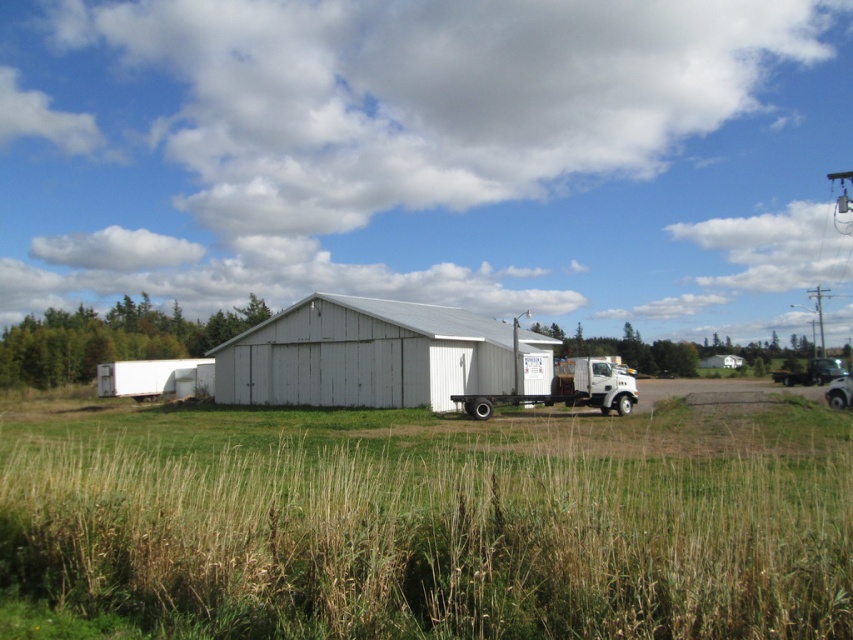
Question: Among these points, which one is nearest to the camera?

Choices:
 (A) (541, 420)
 (B) (518, 400)
 (C) (250, 378)

Answer: (A)

Question: Which point is closer to the camera taking this photo?

Choices:
 (A) (587, 404)
 (B) (294, 392)
 (C) (674, 564)

Answer: (C)

Question: Which point appears farthest from the camera in this image?

Choices:
 (A) (335, 451)
 (B) (366, 385)
 (C) (584, 371)

Answer: (B)

Question: Is green grass at center wider than white matte barn at center?

Choices:
 (A) no
 (B) yes

Answer: (B)

Question: Does green grass at center appear on the right side of white matte trailer truck at center?

Choices:
 (A) no
 (B) yes

Answer: (A)

Question: Is white matte barn at center bigger than white matte trailer truck at center?

Choices:
 (A) no
 (B) yes

Answer: (B)